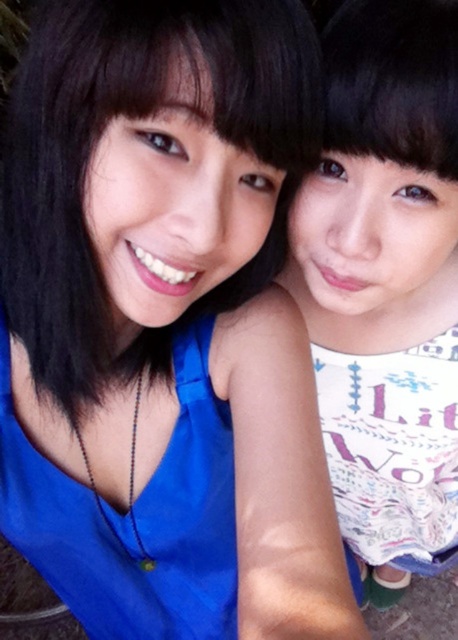
You are a photographer trying to capture a closeup of the white printed dress at center and the matte blue dress at center. Since the dresses are positioned in a way that one is partially covering the other, which dress should you focus on to ensure the other is visible in the background?

The white printed dress at center is above the matte blue dress at center. To ensure the matte blue dress at center is visible in the background, focus on the white printed dress at center.

Consider the image. You are a photographer setting up a backdrop for a photoshoot. You need to ensure that both the white printed dress at center and the matte blue dress at center can fit side by side within a 1.2 meter wide backdrop. Based on the image, can you confirm if they will fit?

The white printed dress at center might be wider than matte blue dress at center. Since the total width of both dresses could exceed 1.2 meters, it is uncertain if they will fit within the backdrop. Further measurement is needed.

Based on the photo, you are a photographer trying to capture a closeup shot of both the white printed dress at center and the matte blue dress at center. Given that your camera has a maximum focus range of 30 centimeters, will you be able to focus on both dresses simultaneously?

The white printed dress at center is 35.16 centimeters away from the matte blue dress at center. Since the distance between them exceeds the camera maximum focus range of 30 centimeters, you cannot focus on both dresses simultaneously.